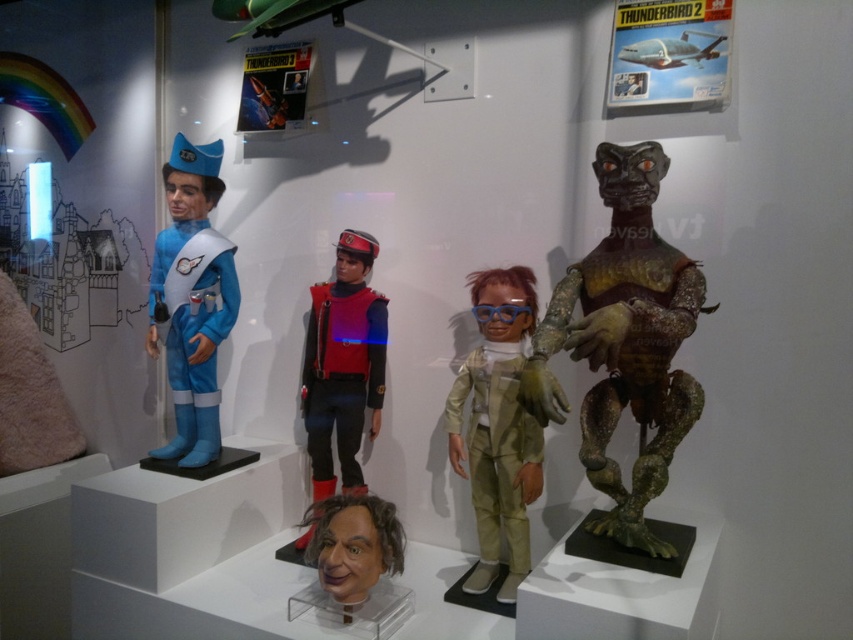
Who is higher up, shiny metallic alien at right or velvet-like red and blue uniform at center?

shiny metallic alien at right is higher up.

Locate an element on the screen. shiny metallic alien at right is located at coordinates (624, 342).

Can you confirm if smooth plastic mask at center is taller than metallic silver airplane at upper center?

Indeed, smooth plastic mask at center has a greater height compared to metallic silver airplane at upper center.

This screenshot has height=640, width=853. What do you see at coordinates (354, 560) in the screenshot? I see `smooth plastic mask at center` at bounding box center [354, 560].

The width and height of the screenshot is (853, 640). Find the location of `smooth plastic mask at center`. smooth plastic mask at center is located at coordinates (354, 560).

Can you confirm if shiny metallic alien at right is wider than light brown fabric doll at center?

Indeed, shiny metallic alien at right has a greater width compared to light brown fabric doll at center.

Which is more to the right, shiny metallic alien at right or light brown fabric doll at center?

shiny metallic alien at right

Consider the image. Who is more forward, (601,262) or (521,300)?

Positioned in front is point (601,262).

Where is `shiny metallic alien at right`? shiny metallic alien at right is located at coordinates click(x=624, y=342).